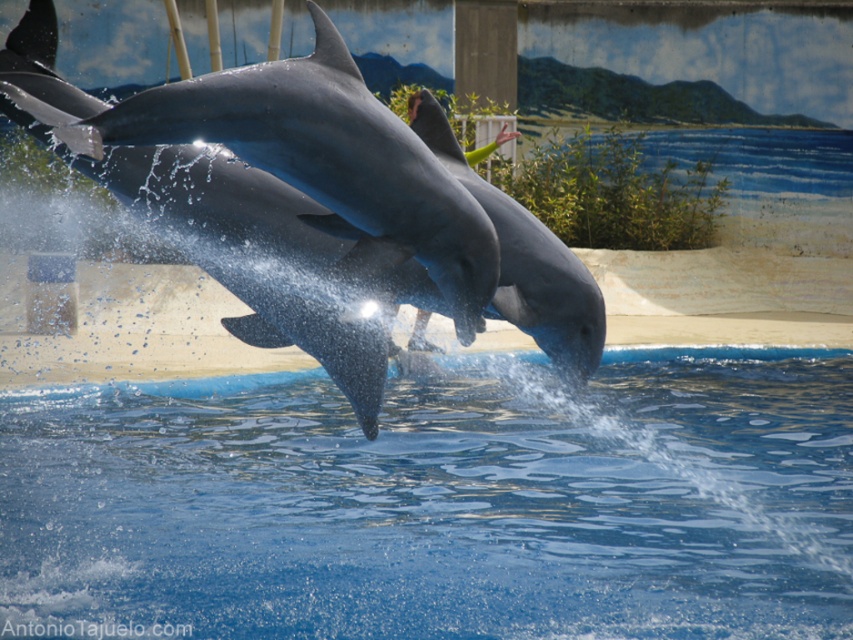
Which of these two, shiny gray dolphin at center or gray smooth dolphin at center, stands shorter?

Standing shorter between the two is shiny gray dolphin at center.

Does point (485, 273) come farther from viewer compared to point (451, 168)?

No, (485, 273) is closer to viewer.

The image size is (853, 640). What are the coordinates of `shiny gray dolphin at center` in the screenshot? It's located at (326, 163).

Can you confirm if blue smooth water at center is bigger than gray smooth dolphin at center?

Actually, blue smooth water at center might be smaller than gray smooth dolphin at center.

Which is below, blue smooth water at center or gray smooth dolphin at center?

blue smooth water at center is lower down.

Image resolution: width=853 pixels, height=640 pixels. Describe the element at coordinates (438, 508) in the screenshot. I see `blue smooth water at center` at that location.

Where is `blue smooth water at center`? The height and width of the screenshot is (640, 853). blue smooth water at center is located at coordinates (438, 508).

Can you confirm if blue smooth water at center is shorter than shiny gray dolphin at center?

Yes, blue smooth water at center is shorter than shiny gray dolphin at center.

Image resolution: width=853 pixels, height=640 pixels. Identify the location of blue smooth water at center. (438, 508).

Is point (12, 406) positioned in front of point (465, 205)?

No, it is not.

The width and height of the screenshot is (853, 640). I want to click on blue smooth water at center, so click(x=438, y=508).